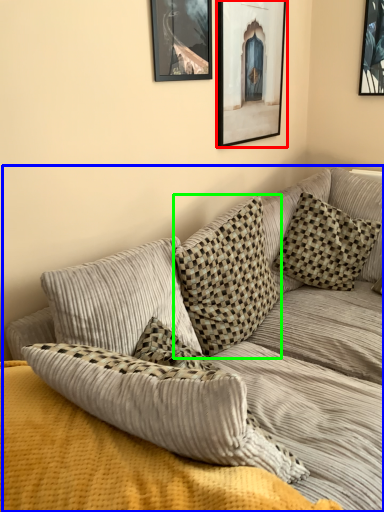
Question: Based on their relative distances, which object is nearer to picture frame (highlighted by a red box)? Choose from studio couch (highlighted by a blue box) and pillow (highlighted by a green box).

Choices:
 (A) studio couch
 (B) pillow

Answer: (B)